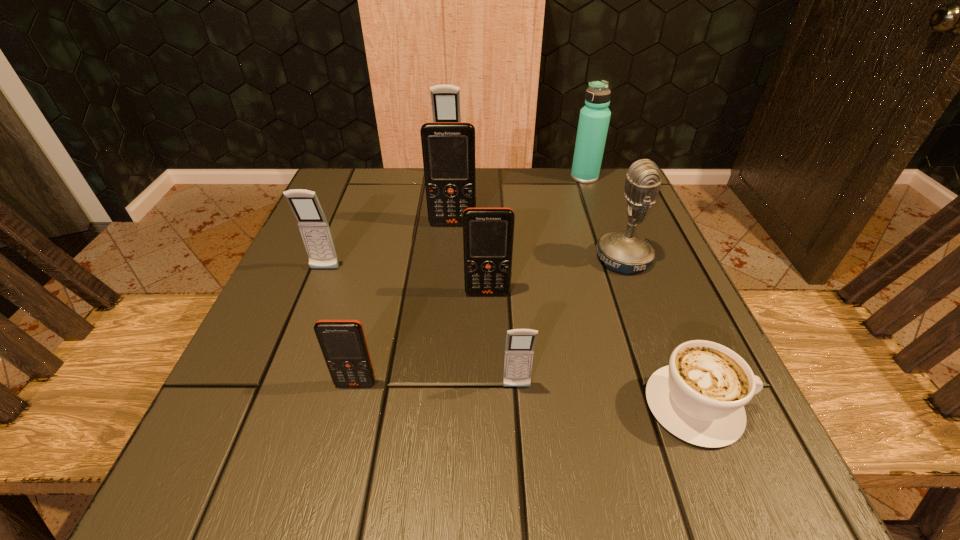
Where is `the second object from left to right`? the second object from left to right is located at coordinates (343, 344).

Locate an element on the screen. the nearest orange cellular telephone is located at coordinates (343, 344).

Find the location of a particular element. Image resolution: width=960 pixels, height=540 pixels. the rightmost gray cellular telephone is located at coordinates (520, 343).

Locate an element on the screen. The width and height of the screenshot is (960, 540). the smallest gray cellular telephone is located at coordinates [x=520, y=343].

At what (x,y) coordinates should I click in order to perform the action: click on cappuccino. Please return your answer as a coordinate pair (x, y). Looking at the image, I should click on (699, 397).

I want to click on blank area located 0.050m on the left of the thermos bottle, so click(551, 177).

This screenshot has width=960, height=540. I want to click on vacant space located on the front-facing side of the farthest cellular telephone, so click(x=445, y=212).

Where is `free point located 0.400m on the screen of the third farthest object`? free point located 0.400m on the screen of the third farthest object is located at coordinates (440, 388).

I want to click on free space located 0.050m on the front-facing side of the microphone, so click(x=569, y=258).

Where is `vacant space located on the front-facing side of the microphone`? The width and height of the screenshot is (960, 540). vacant space located on the front-facing side of the microphone is located at coordinates 468,258.